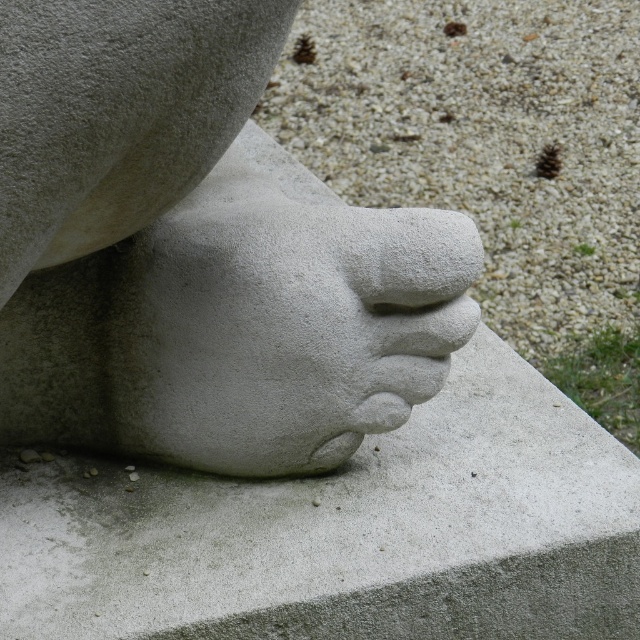
Can you confirm if white stone foot at center is smaller than gray stone sculpture at center?

No.

Does white stone foot at center have a greater width compared to gray stone sculpture at center?

Incorrect, white stone foot at center's width does not surpass gray stone sculpture at center's.

The image size is (640, 640). Identify the location of white stone foot at center. 198,252.

You are a GUI agent. You are given a task and a screenshot of the screen. Output one action in this format:
    pyautogui.click(x=<x>, y=<y>)
    Task: Click on the white stone foot at center
    
    Given the screenshot: What is the action you would take?
    pyautogui.click(x=198, y=252)

Which is more to the left, white stone foot at center or white stone hand at center?

white stone foot at center is more to the left.

Can you confirm if white stone foot at center is positioned below white stone hand at center?

No.

Who is more distant from viewer, (138, 394) or (157, 257)?

Point (138, 394)

At what (x,y) coordinates should I click in order to perform the action: click on white stone foot at center. Please return your answer as a coordinate pair (x, y). Image resolution: width=640 pixels, height=640 pixels. Looking at the image, I should click on (198, 252).

Who is more forward, [419,515] or [189,403]?

Point [419,515] is in front.

Which is more to the left, gray stone sculpture at center or white stone hand at center?

white stone hand at center

Find the location of a particular element. The height and width of the screenshot is (640, 640). gray stone sculpture at center is located at coordinates (344, 531).